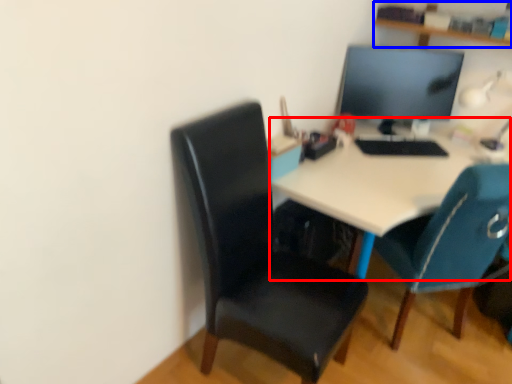
Question: Which object is closer to the camera taking this photo, desk (highlighted by a red box) or shelf (highlighted by a blue box)?

Choices:
 (A) desk
 (B) shelf

Answer: (A)